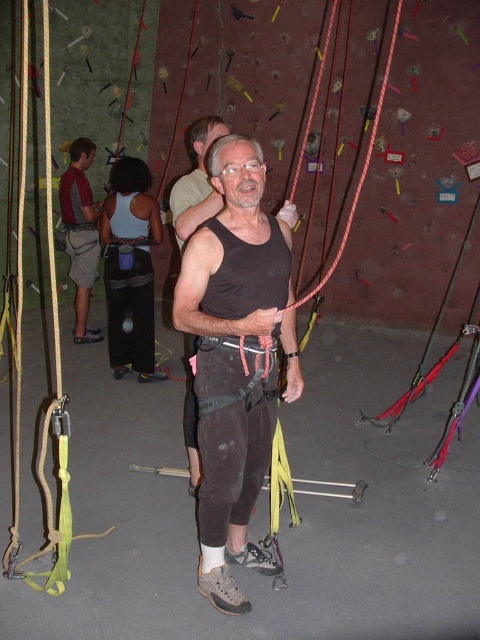
Between black matte tank top at center and brushed metal tank top at left, which one is positioned higher?

brushed metal tank top at left is higher up.

Is black matte tank top at center shorter than brushed metal tank top at left?

Correct, black matte tank top at center is not as tall as brushed metal tank top at left.

Is point (178, 316) in front of point (96, 260)?

Yes, it is.

At what (x,y) coordinates should I click in order to perform the action: click on black matte tank top at center. Please return your answer as a coordinate pair (x, y). The width and height of the screenshot is (480, 640). Looking at the image, I should click on (236, 358).